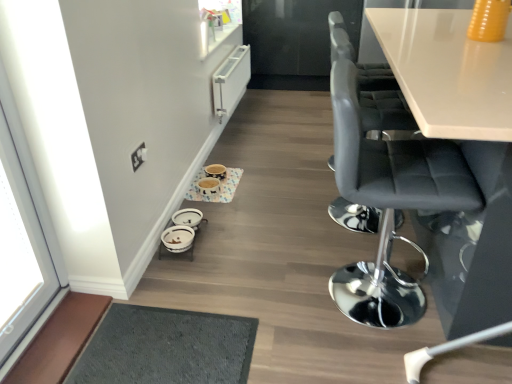
You are a GUI agent. You are given a task and a screenshot of the screen. Output one action in this format:
    pyautogui.click(x=<x>, y=<y>)
    Task: Click on the vacant space situated on the left part of gray fabric chair at right, the 2th chair viewed from the front
    
    Given the screenshot: What is the action you would take?
    pyautogui.click(x=289, y=210)